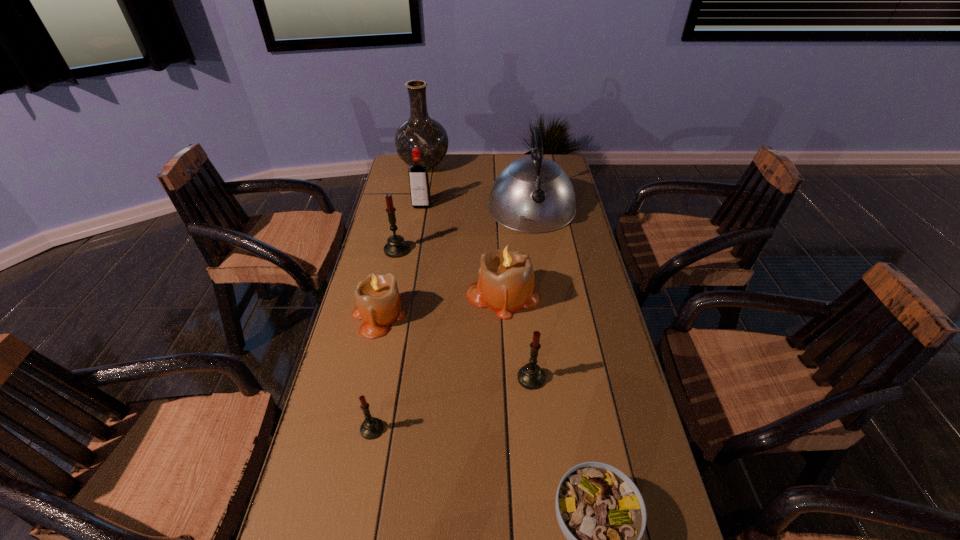
The image size is (960, 540). In order to click on the second nearest object in this screenshot , I will do `click(371, 428)`.

Find the location of a particular element. vacant point located 0.170m on the front of the farthest object is located at coordinates (418, 202).

At what (x,y) coordinates should I click in order to perform the action: click on vacant space located from the spout of the kettle. Please return your answer as a coordinate pair (x, y). This screenshot has width=960, height=540. Looking at the image, I should click on (539, 257).

Locate an element on the screen. Image resolution: width=960 pixels, height=540 pixels. free point located 0.090m on the front and back of the red vodka is located at coordinates (419, 224).

The width and height of the screenshot is (960, 540). In order to click on vacant region located on the front of the sixth nearest object in this screenshot , I will do `click(380, 330)`.

The width and height of the screenshot is (960, 540). In order to click on vacant region located on the back of the right beige candle in this screenshot , I will do `click(497, 204)`.

The width and height of the screenshot is (960, 540). In order to click on blank space located 0.050m on the front of the second nearest candle in this screenshot , I will do tap(534, 408).

The image size is (960, 540). I want to click on vacant area situated on the front of the left beige candle, so click(351, 436).

This screenshot has height=540, width=960. Identify the location of free space located 0.180m on the back of the nearest candle. (386, 356).

Locate an element on the screen. object present at the far edge is located at coordinates (420, 131).